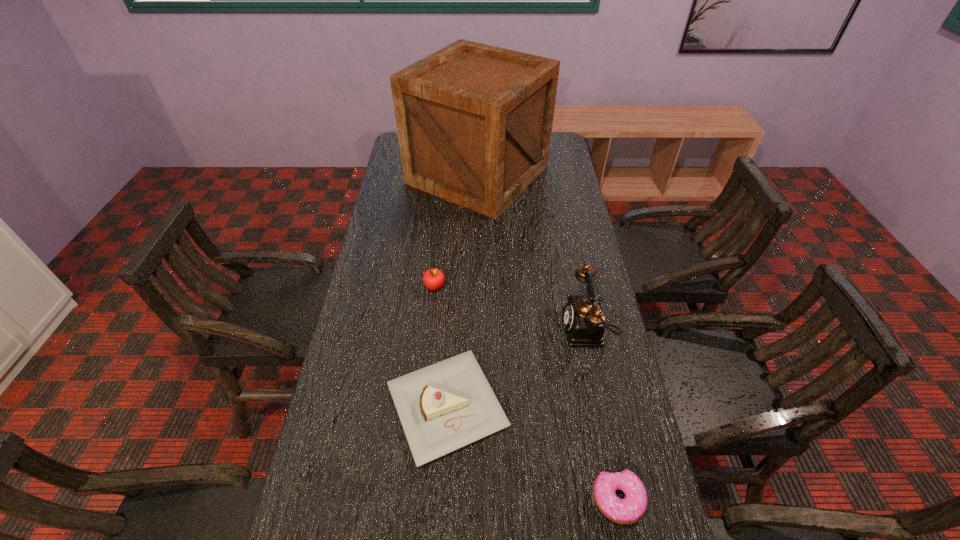
The height and width of the screenshot is (540, 960). I want to click on box, so click(474, 122).

Identify the location of the farthest object. Image resolution: width=960 pixels, height=540 pixels. (474, 122).

Locate an element on the screen. The height and width of the screenshot is (540, 960). the second tallest object is located at coordinates (584, 322).

This screenshot has width=960, height=540. What are the coordinates of `apple` in the screenshot? It's located at (433, 279).

At what (x,y) coordinates should I click in order to perform the action: click on cake. Please return your answer as a coordinate pair (x, y). This screenshot has width=960, height=540. Looking at the image, I should click on (443, 407).

The width and height of the screenshot is (960, 540). What are the coordinates of `the shortest object` in the screenshot? It's located at coord(632,508).

The image size is (960, 540). I want to click on the nearest object, so click(632, 508).

You are a GUI agent. You are given a task and a screenshot of the screen. Output one action in this format:
    pyautogui.click(x=<x>, y=<y>)
    Task: Click on the vacant region located on the front of the box
    The image size is (960, 540).
    Given the screenshot: What is the action you would take?
    pyautogui.click(x=477, y=245)

Locate an element on the screen. This screenshot has width=960, height=540. free spot located 0.310m on the front of the fourth shortest object at the rotary dial is located at coordinates (454, 329).

The width and height of the screenshot is (960, 540). I want to click on free space located 0.230m on the front of the fourth shortest object at the rotary dial, so click(482, 329).